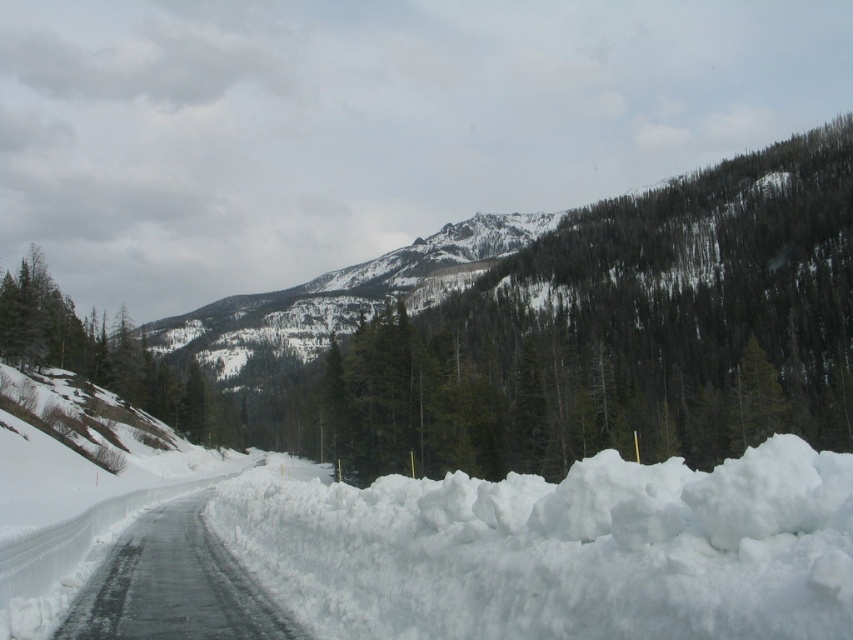
Question: Is white fluffy snow at center above icy asphalt road at center?

Choices:
 (A) no
 (B) yes

Answer: (B)

Question: Which object is positioned farthest from the snowy rocky peak at center?

Choices:
 (A) white fluffy snow at center
 (B) icy asphalt road at center

Answer: (B)

Question: Which of the following is the farthest from the observer?

Choices:
 (A) icy asphalt road at center
 (B) white fluffy snow at center
 (C) snowy rocky peak at center

Answer: (C)

Question: Is snowy rocky peak at center above icy asphalt road at center?

Choices:
 (A) yes
 (B) no

Answer: (A)

Question: Considering the real-world distances, which object is closest to the snowy rocky peak at center?

Choices:
 (A) white fluffy snow at center
 (B) icy asphalt road at center

Answer: (A)

Question: Observing the image, what is the correct spatial positioning of snowy rocky peak at center in reference to icy asphalt road at center?

Choices:
 (A) right
 (B) left

Answer: (B)